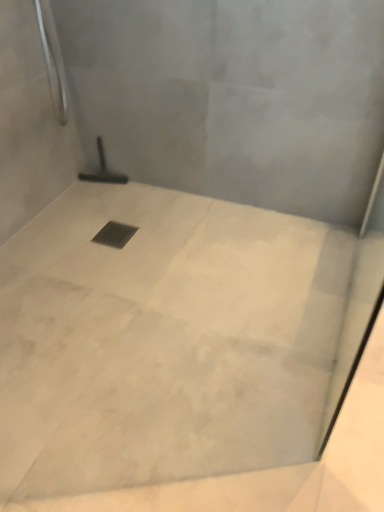
Question: Is white marble floor at center taller than black metal drain at center?

Choices:
 (A) no
 (B) yes

Answer: (B)

Question: Is white marble floor at center far from black metal drain at center?

Choices:
 (A) yes
 (B) no

Answer: (B)

Question: From a real-world perspective, is white marble floor at center located beneath black metal drain at center?

Choices:
 (A) yes
 (B) no

Answer: (B)

Question: Is white marble floor at center behind black metal drain at center?

Choices:
 (A) no
 (B) yes

Answer: (A)

Question: From the image's perspective, is white marble floor at center under black metal drain at center?

Choices:
 (A) yes
 (B) no

Answer: (A)

Question: Considering the relative positions of white marble floor at center and black metal drain at center in the image provided, is white marble floor at center to the right of black metal drain at center from the viewer's perspective?

Choices:
 (A) no
 (B) yes

Answer: (B)

Question: Is white marble floor at center facing away from black rubber squeegee at center?

Choices:
 (A) no
 (B) yes

Answer: (A)

Question: From a real-world perspective, is white marble floor at center located higher than black rubber squeegee at center?

Choices:
 (A) no
 (B) yes

Answer: (A)

Question: From a real-world perspective, is white marble floor at center under black rubber squeegee at center?

Choices:
 (A) yes
 (B) no

Answer: (A)

Question: Is white marble floor at center aimed at black rubber squeegee at center?

Choices:
 (A) no
 (B) yes

Answer: (A)

Question: Considering the relative sizes of white marble floor at center and black rubber squeegee at center in the image provided, is white marble floor at center bigger than black rubber squeegee at center?

Choices:
 (A) yes
 (B) no

Answer: (A)

Question: Is white marble floor at center positioned far away from black rubber squeegee at center?

Choices:
 (A) no
 (B) yes

Answer: (A)

Question: Does black rubber squeegee at center come behind black metal drain at center?

Choices:
 (A) no
 (B) yes

Answer: (B)